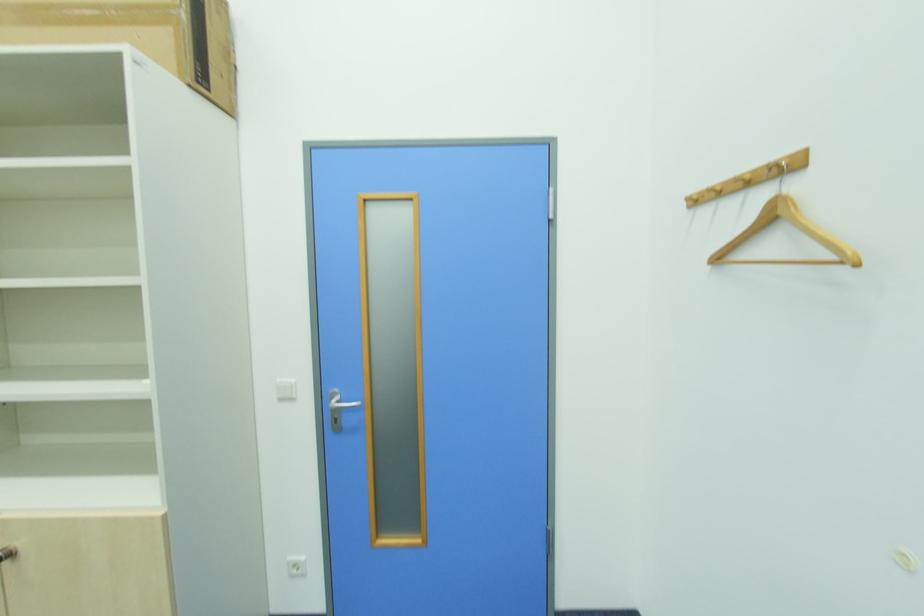
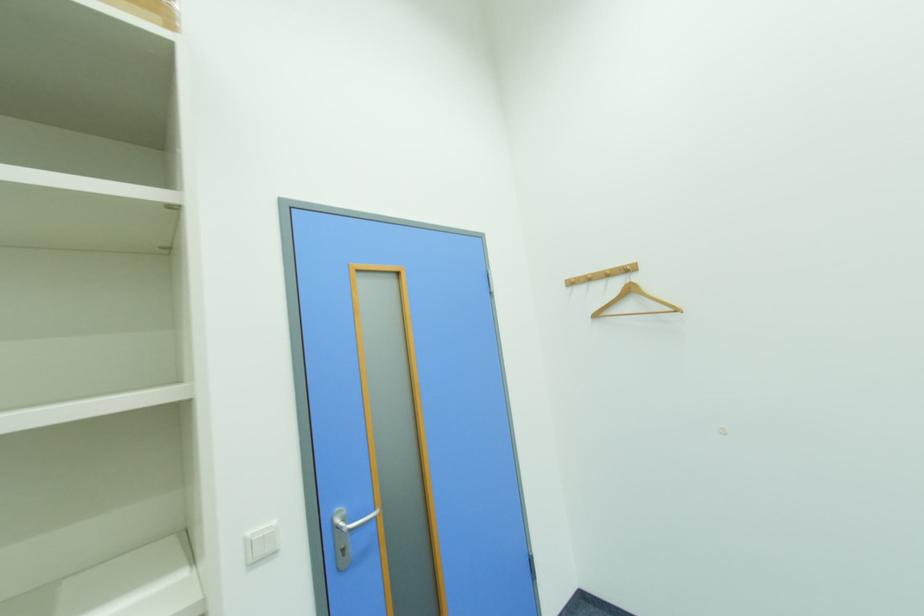
Question: I am providing you with two images of the same scene from different viewpoints. After the viewpoint changes to image2, which objects are now occluded?

Choices:
 (A) white light switch
 (B) wooden clothes hanger
 (C) metal door handle
 (D) none of these

Answer: (D)